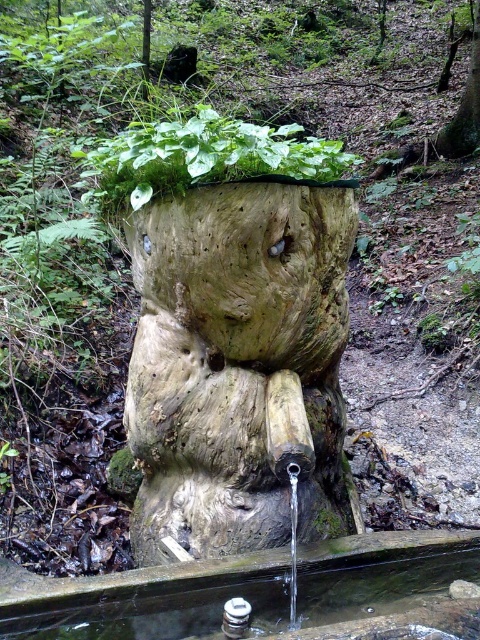
You are a hiker who wants to fill your water bottle. You see the clear glass water at lower center and the rough bark tree trunk at upper center. Which object should you interact with to get water?

You should interact with the clear glass water at lower center to fill your water bottle because it is the source of water, located under the rough bark tree trunk at upper center.

You are standing in a forest and see the natural wood fountain at center and the clear glass water at lower center. Which object is positioned to the right side of the scene?

The clear glass water at lower center is positioned to the right side of the scene because the natural wood fountain at center is to the left of it.